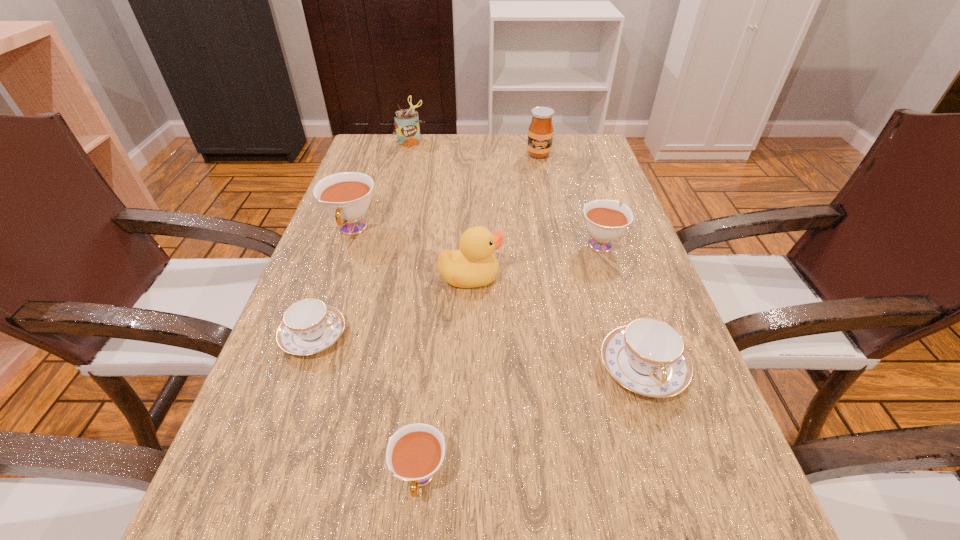
Locate an element on the screen. This screenshot has width=960, height=540. the farthest object is located at coordinates (406, 122).

Where is `the second farthest object`? the second farthest object is located at coordinates (540, 133).

What are the coordinates of `honey` in the screenshot? It's located at (540, 133).

The image size is (960, 540). I want to click on yellow duck, so click(474, 265).

What are the coordinates of `duck` in the screenshot? It's located at (474, 265).

The width and height of the screenshot is (960, 540). In order to click on the leftmost white teacup in this screenshot , I will do `click(346, 196)`.

You are a GUI agent. You are given a task and a screenshot of the screen. Output one action in this format:
    pyautogui.click(x=<x>, y=<y>)
    Task: Click on the biggest white teacup
    The height and width of the screenshot is (540, 960).
    Given the screenshot: What is the action you would take?
    pyautogui.click(x=346, y=196)

The width and height of the screenshot is (960, 540). I want to click on the second biggest white teacup, so click(x=605, y=221).

Locate an element on the screen. This screenshot has height=540, width=960. the right blue teacup is located at coordinates (648, 357).

In order to click on the nearest object in this screenshot , I will do `click(414, 453)`.